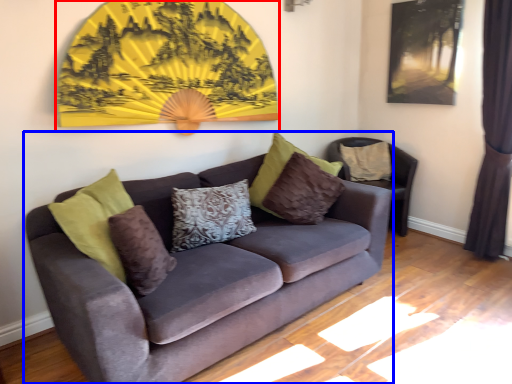
Question: Which of the following is the farthest to the observer, decor (highlighted by a red box) or studio couch (highlighted by a blue box)?

Choices:
 (A) decor
 (B) studio couch

Answer: (A)